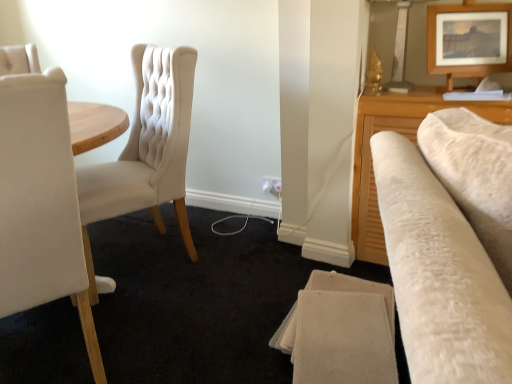
You are a GUI agent. You are given a task and a screenshot of the screen. Output one action in this format:
    pyautogui.click(x=<x>, y=<y>)
    Task: Click on the free space between white leather chair at left, placed as the first chair when sorted from front to back, and matte cream fabric chair at left, the 2th chair when ordered from front to back
    This screenshot has height=384, width=512.
    Given the screenshot: What is the action you would take?
    pyautogui.click(x=152, y=313)